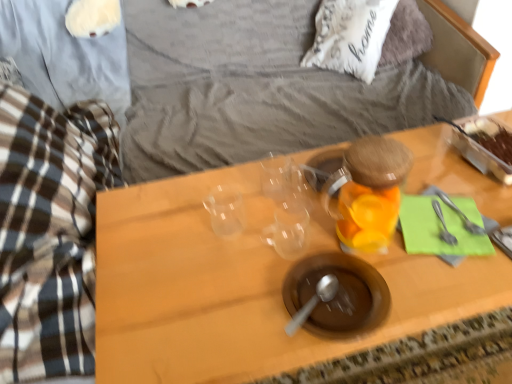
You are a GUI agent. You are given a task and a screenshot of the screen. Output one action in this format:
    pyautogui.click(x=<x>, y=<y>)
    Task: Click on the transparent plastic cups at center
    The image size is (512, 384).
    Given the screenshot: What is the action you would take?
    pyautogui.click(x=241, y=290)

The image size is (512, 384). What do you see at coordinates (369, 192) in the screenshot? I see `transparent glass jar at center-right` at bounding box center [369, 192].

Where is `silver metallic fork at right, which is the second silverware in right-to-left order`? The width and height of the screenshot is (512, 384). silver metallic fork at right, which is the second silverware in right-to-left order is located at coordinates (443, 225).

What are the coordinates of `silver metallic fork at right, which is the 1th silverware from right to left` in the screenshot? It's located at (461, 215).

Locate an element on the screen. This screenshot has height=384, width=512. transparent plastic cups at center is located at coordinates (241, 290).

Which object is closer to the camera taking this photo, silver metallic fork at right, which is the second silverware in right-to-left order, or white soft pillow at upper center?

silver metallic fork at right, which is the second silverware in right-to-left order, is closer to the camera.

Is there a large distance between silver metallic fork at right, which ranks as the 1th silverware in left-to-right order, and white soft pillow at upper center?

That's right, there is a large distance between silver metallic fork at right, which ranks as the 1th silverware in left-to-right order, and white soft pillow at upper center.

Is silver metallic fork at right, which is the second silverware in right-to-left order, facing towards white soft pillow at upper center?

No, silver metallic fork at right, which is the second silverware in right-to-left order, is not aimed at white soft pillow at upper center.

Looking at this image, from a real-world perspective, relative to white soft pillow at upper center, is silver metallic fork at right, which is the second silverware in right-to-left order, vertically above or below?

In terms of real-world spatial position, silver metallic fork at right, which is the second silverware in right-to-left order, is above white soft pillow at upper center.

What's the angular difference between transparent plastic cups at center and white soft pillow at upper center's facing directions?

The angle between the facing direction of transparent plastic cups at center and the facing direction of white soft pillow at upper center is 46.1 degrees.

Which is more to the left, transparent plastic cups at center or white soft pillow at upper center?

Positioned to the left is transparent plastic cups at center.

Is point (204, 363) behind point (348, 11)?

No, it is not.

Are transparent glass jar at center-right and silver metallic fork at right, which is the second silverware in right-to-left order, located far from each other?

transparent glass jar at center-right is actually quite close to silver metallic fork at right, which is the second silverware in right-to-left order.

Is transparent glass jar at center-right bigger than silver metallic fork at right, which is the second silverware in right-to-left order?

Correct, transparent glass jar at center-right is larger in size than silver metallic fork at right, which is the second silverware in right-to-left order.

From the image's perspective, who appears lower, transparent glass jar at center-right or silver metallic fork at right, which is the second silverware in right-to-left order?

silver metallic fork at right, which is the second silverware in right-to-left order, appears lower in the image.

Is silver metallic fork at right, which is the 1th silverware from right to left, far away from white soft pillow at upper center?

That's not correct — silver metallic fork at right, which is the 1th silverware from right to left, is a little close to white soft pillow at upper center.

Consider the image. Considering the relative sizes of silver metallic fork at right, which is the 1th silverware from right to left, and white soft pillow at upper center in the image provided, is silver metallic fork at right, which is the 1th silverware from right to left, smaller than white soft pillow at upper center?

Indeed, silver metallic fork at right, which is the 1th silverware from right to left, has a smaller size compared to white soft pillow at upper center.

Considering the positions of objects silver metallic fork at right, which is the 1th silverware from right to left, and white soft pillow at upper center in the image provided, who is behind, silver metallic fork at right, which is the 1th silverware from right to left, or white soft pillow at upper center?

white soft pillow at upper center is further from the camera.

Which point is more distant from viewer, [349,55] or [351,317]?

Positioned behind is point [349,55].

Is white soft pillow at upper center in front of or behind brown matte bowl at center in the image?

Visually, white soft pillow at upper center is located behind brown matte bowl at center.

Identify the location of tableware in front of the white soft pillow at upper center. The height and width of the screenshot is (384, 512). (337, 294).

Is brown matte bowl at center at the back of white soft pillow at upper center?

No, brown matte bowl at center is not at the back of white soft pillow at upper center.

Which of these two, silver metallic fork at right, which is the second silverware in right-to-left order, or transparent glass jar at center-right, is bigger?

Bigger between the two is transparent glass jar at center-right.

Could you tell me if silver metallic fork at right, which ranks as the 1th silverware in left-to-right order, is turned towards transparent glass jar at center-right?

No, silver metallic fork at right, which ranks as the 1th silverware in left-to-right order, is not facing towards transparent glass jar at center-right.

Locate an element on the screen. The image size is (512, 384). bottle above the silver metallic fork at right, which is the second silverware in right-to-left order (from a real-world perspective) is located at coordinates (369, 192).

Which is in front, transparent glass jar at center-right or brown matte bowl at center?

Positioned in front is transparent glass jar at center-right.

How different are the orientations of transparent glass jar at center-right and brown matte bowl at center in degrees?

The facing directions of transparent glass jar at center-right and brown matte bowl at center are 0.00248 degrees apart.

This screenshot has width=512, height=384. In the image, there is a transparent glass jar at center-right. Find the location of `tableware below it (from the image's perspective)`. tableware below it (from the image's perspective) is located at coordinates (337, 294).

Does point (375, 231) come in front of point (345, 283)?

No, it is behind (345, 283).

Find the location of a particular element. pillow above the silver metallic fork at right, which is the second silverware in right-to-left order (from the image's perspective) is located at coordinates (350, 36).

Identify the location of pillow positioned vertically above the transparent plastic cups at center (from a real-world perspective). The image size is (512, 384). (350, 36).

Based on their spatial positions, is brown matte bowl at center or transparent glass jar at center-right further from silver metallic fork at right, the second silverware positioned from the left?

brown matte bowl at center lies further to silver metallic fork at right, the second silverware positioned from the left, than the other object.

When comparing their distances from transparent glass jar at center-right, does white soft pillow at upper center or silver metallic fork at right, which is the 1th silverware from right to left, seem further?

Based on the image, white soft pillow at upper center appears to be further to transparent glass jar at center-right.

Considering their positions, is white soft pillow at upper center positioned further to silver metallic fork at right, which ranks as the 1th silverware in left-to-right order, than transparent plastic cups at center?

white soft pillow at upper center lies further to silver metallic fork at right, which ranks as the 1th silverware in left-to-right order, than the other object.

Looking at the image, which one is located further to transparent plastic cups at center, transparent glass jar at center-right or white soft pillow at upper center?

Among the two, white soft pillow at upper center is located further to transparent plastic cups at center.

When comparing their distances from silver metallic fork at right, which ranks as the 1th silverware in left-to-right order, does white soft pillow at upper center or brown matte bowl at center seem closer?

brown matte bowl at center is closer to silver metallic fork at right, which ranks as the 1th silverware in left-to-right order.

From the image, which object appears to be nearer to transparent plastic cups at center, brown matte bowl at center or silver metallic fork at right, the second silverware positioned from the left?

brown matte bowl at center is closer to transparent plastic cups at center.

Estimate the real-world distances between objects in this image. Which object is closer to brown matte bowl at center, transparent plastic cups at center or white soft pillow at upper center?

The object closer to brown matte bowl at center is transparent plastic cups at center.

Looking at the image, which one is located closer to brown matte bowl at center, silver metallic fork at right, which is the second silverware in right-to-left order, or silver metallic fork at right, which is the 1th silverware from right to left?

silver metallic fork at right, which is the second silverware in right-to-left order.

I want to click on desk between brown matte bowl at center and silver metallic fork at right, which is the second silverware in right-to-left order, so click(x=241, y=290).

The image size is (512, 384). I want to click on tableware positioned between transparent glass jar at center-right and white soft pillow at upper center from near to far, so click(337, 294).

Find the location of `bottle between brown matte bowl at center and silver metallic fork at right, the second silverware positioned from the left`. bottle between brown matte bowl at center and silver metallic fork at right, the second silverware positioned from the left is located at coordinates (369, 192).

This screenshot has height=384, width=512. Identify the location of silverware between transparent plastic cups at center and silver metallic fork at right, the second silverware positioned from the left, along the z-axis. (443, 225).